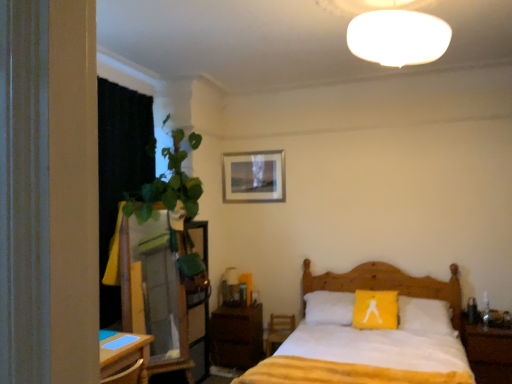
Where is `free spot above dark brown wood nightstand at lower center, the 2th nightstand from the right (from a real-world perspective)`? free spot above dark brown wood nightstand at lower center, the 2th nightstand from the right (from a real-world perspective) is located at coordinates (236, 307).